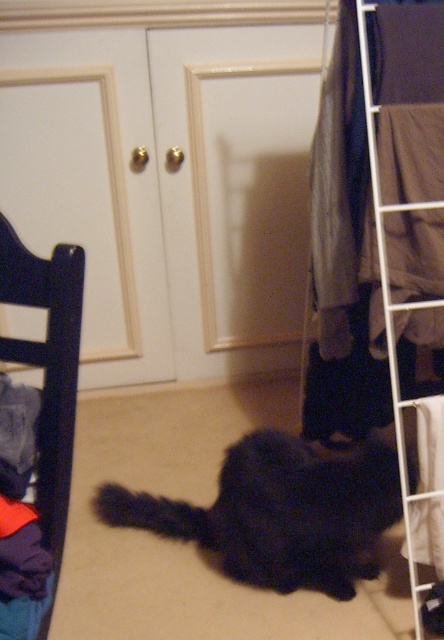
How much distance is there between dark wood chair at left and white wire rack at right?

dark wood chair at left is 75.48 centimeters from white wire rack at right.

Does dark wood chair at left appear over white wire rack at right?

No.

Where is `dark wood chair at left`? The image size is (444, 640). dark wood chair at left is located at coordinates pyautogui.click(x=48, y=364).

Is black fluffy cat at center shorter than dark wood chair at left?

Correct, black fluffy cat at center is not as tall as dark wood chair at left.

At what (x,y) coordinates should I click in order to perform the action: click on black fluffy cat at center. Please return your answer as a coordinate pair (x, y). The width and height of the screenshot is (444, 640). Looking at the image, I should click on (281, 513).

Find the location of a particular element. The height and width of the screenshot is (640, 444). black fluffy cat at center is located at coordinates (281, 513).

Does black fluffy cat at center have a larger size compared to white wire rack at right?

Correct, black fluffy cat at center is larger in size than white wire rack at right.

Does black fluffy cat at center have a smaller size compared to white wire rack at right?

Actually, black fluffy cat at center might be larger than white wire rack at right.

What do you see at coordinates (281, 513) in the screenshot?
I see `black fluffy cat at center` at bounding box center [281, 513].

Identify the location of black fluffy cat at center. This screenshot has height=640, width=444. (281, 513).